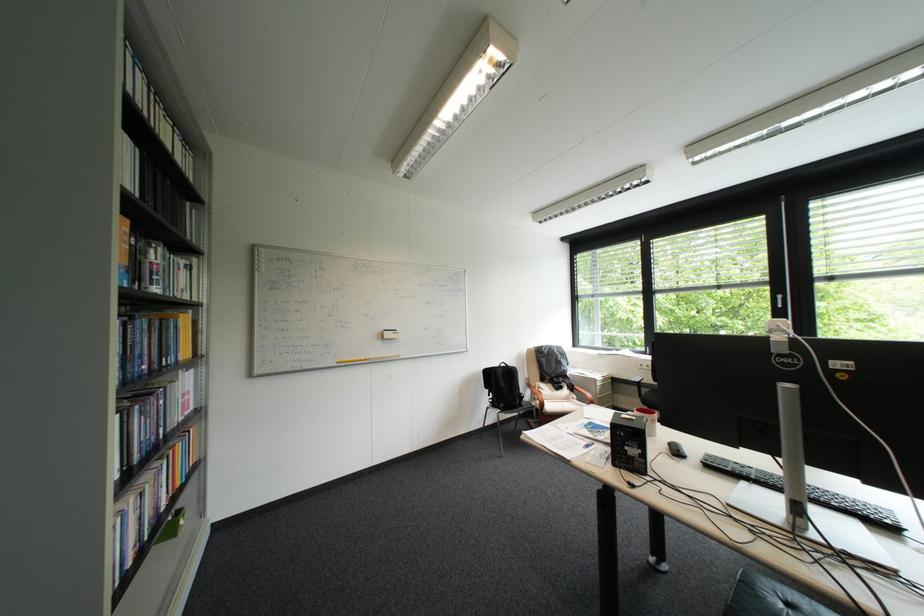
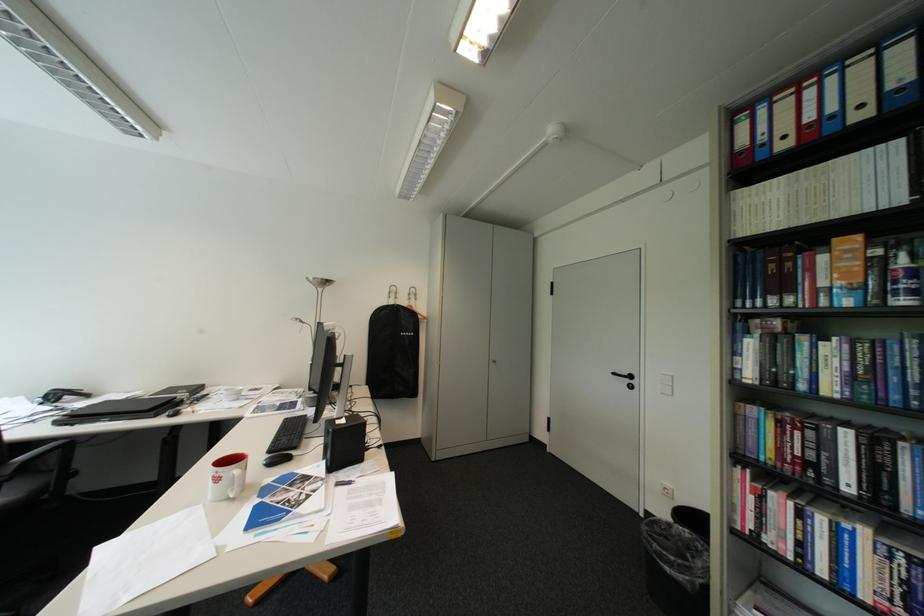
The point at (164, 275) is marked in the first image. Where is the corresponding point in the second image?

(907, 284)